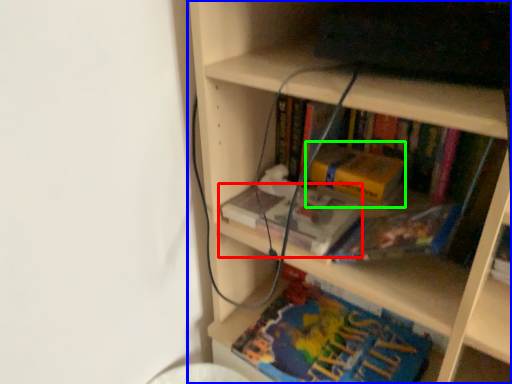
Question: Which is nearer to the book (highlighted by a red box)? bookcase (highlighted by a blue box) or paperback book (highlighted by a green box).

Choices:
 (A) bookcase
 (B) paperback book

Answer: (B)